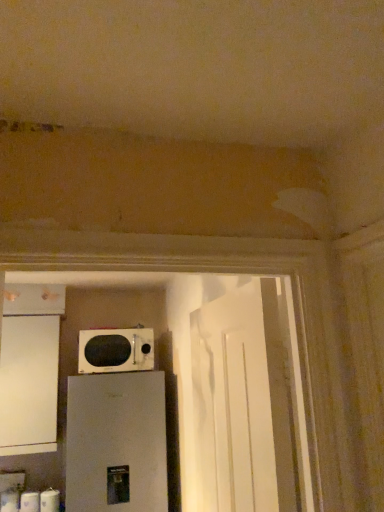
Question: Is white matte toilet paper at lower left, which is the second toilet paper in left-to-right order, placed right next to white glossy door at center?

Choices:
 (A) yes
 (B) no

Answer: (B)

Question: Is white matte toilet paper at lower left, the 2th toilet paper in the right-to-left sequence, positioned before white glossy door at center?

Choices:
 (A) no
 (B) yes

Answer: (A)

Question: Considering the relative sizes of white matte toilet paper at lower left, the 2th toilet paper in the right-to-left sequence, and white glossy door at center in the image provided, is white matte toilet paper at lower left, the 2th toilet paper in the right-to-left sequence, taller than white glossy door at center?

Choices:
 (A) yes
 (B) no

Answer: (B)

Question: From the image's perspective, is white matte toilet paper at lower left, which is the second toilet paper in left-to-right order, located above white glossy door at center?

Choices:
 (A) yes
 (B) no

Answer: (B)

Question: Does white matte toilet paper at lower left, the 2th toilet paper in the right-to-left sequence, have a larger size compared to white glossy door at center?

Choices:
 (A) no
 (B) yes

Answer: (A)

Question: Can you confirm if white matte toilet paper at lower left, which is the second toilet paper in left-to-right order, is shorter than white glossy door at center?

Choices:
 (A) no
 (B) yes

Answer: (B)

Question: Is white matte toilet paper at lower left, which is counted as the 1th toilet paper, starting from the left, far away from white matte toilet paper at lower left, which is counted as the 1th toilet paper, starting from the right?

Choices:
 (A) no
 (B) yes

Answer: (A)

Question: From the image's perspective, is white matte toilet paper at lower left, which is counted as the 1th toilet paper, starting from the left, located above white matte toilet paper at lower left, which is counted as the 1th toilet paper, starting from the right?

Choices:
 (A) yes
 (B) no

Answer: (B)

Question: Considering the relative positions of white matte toilet paper at lower left, which ranks as the third toilet paper in right-to-left order, and white matte toilet paper at lower left, which is counted as the 1th toilet paper, starting from the right, in the image provided, is white matte toilet paper at lower left, which ranks as the third toilet paper in right-to-left order, to the right of white matte toilet paper at lower left, which is counted as the 1th toilet paper, starting from the right, from the viewer's perspective?

Choices:
 (A) no
 (B) yes

Answer: (A)

Question: Is white matte toilet paper at lower left, positioned as the 3th toilet paper in left-to-right order, surrounded by white matte toilet paper at lower left, which is counted as the 1th toilet paper, starting from the left?

Choices:
 (A) no
 (B) yes

Answer: (A)

Question: From a real-world perspective, is white matte toilet paper at lower left, which is counted as the 1th toilet paper, starting from the left, under white matte toilet paper at lower left, which is counted as the 1th toilet paper, starting from the right?

Choices:
 (A) no
 (B) yes

Answer: (A)

Question: Is white matte toilet paper at lower left, which ranks as the third toilet paper in right-to-left order, directly adjacent to white matte toilet paper at lower left, which is counted as the 1th toilet paper, starting from the right?

Choices:
 (A) no
 (B) yes

Answer: (A)

Question: Is white glossy microwave at center taller than white matte toilet paper at lower left, the 2th toilet paper in the right-to-left sequence?

Choices:
 (A) no
 (B) yes

Answer: (B)